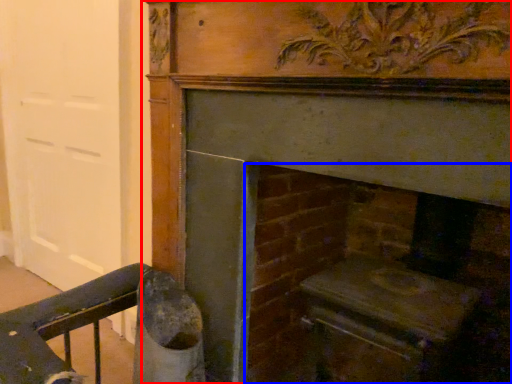
Question: Which object is further to the camera taking this photo, fireplace (highlighted by a red box) or fireplace (highlighted by a blue box)?

Choices:
 (A) fireplace
 (B) fireplace

Answer: (B)